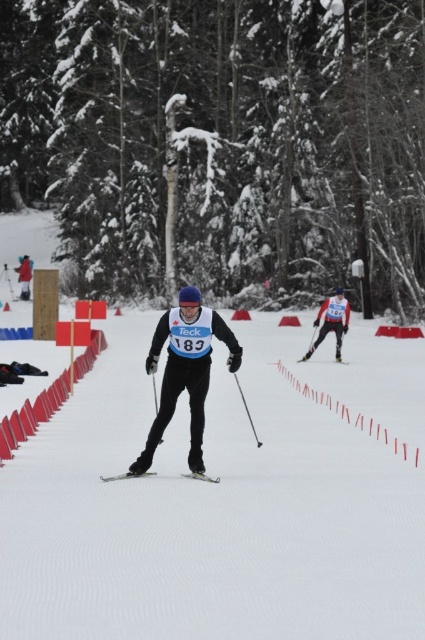
You are a cross country skier participating in a race. You see a point marked at coordinates (353, 417). What is located at this point?

The point at coordinates (353, 417) marks smooth plastic tape at center.

You are a photographer at the cross country skiing event. You want to capture a photo of the black plastic ski pole at center and the matte black ski at right. Which object is narrower in your photo?

The black plastic ski pole at center has a lesser width compared to matte black ski at right, so the black plastic ski pole at center is narrower in the photo.

You are a cross country skier preparing to navigate a course. You notice the smooth plastic tape at center and the matte black ski at right. Which object is wider?

The smooth plastic tape at center is wider than the matte black ski at right.